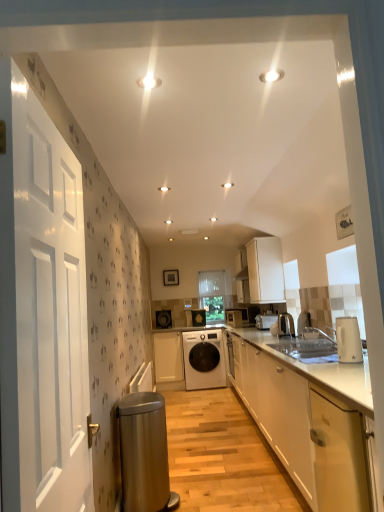
Question: Is white matte cabinet at upper center, positioned as the 3th cabinetry in front-to-back order, wider than white glossy toaster at center, the fourth appliance viewed from the back?

Choices:
 (A) yes
 (B) no

Answer: (A)

Question: Is white matte cabinet at upper center, positioned as the 3th cabinetry in front-to-back order, taller than white glossy toaster at center, the fourth appliance viewed from the back?

Choices:
 (A) yes
 (B) no

Answer: (A)

Question: Does white matte cabinet at upper center, the second cabinetry in the back-to-front sequence, have a smaller size compared to white glossy toaster at center, the fourth appliance viewed from the back?

Choices:
 (A) yes
 (B) no

Answer: (B)

Question: From a real-world perspective, is white matte cabinet at upper center, positioned as the 3th cabinetry in front-to-back order, located beneath white glossy toaster at center, the fourth appliance viewed from the back?

Choices:
 (A) yes
 (B) no

Answer: (B)

Question: From the image's perspective, would you say white matte cabinet at upper center, which is the fourth cabinetry in left-to-right order, is shown under white glossy toaster at center, the fourth appliance viewed from the back?

Choices:
 (A) no
 (B) yes

Answer: (A)

Question: Looking at the image, does matte black washing machine at center, the 2th appliance from the back, seem bigger or smaller compared to white glossy cabinet at lower right, the 2th cabinetry in the left-to-right sequence?

Choices:
 (A) small
 (B) big

Answer: (A)

Question: In the image, is matte black washing machine at center, the 5th appliance positioned from the front, positioned in front of or behind white glossy cabinet at lower right, the third cabinetry from the right?

Choices:
 (A) behind
 (B) front

Answer: (A)

Question: In the image, is matte black washing machine at center, the 2th appliance from the back, on the left side or the right side of white glossy cabinet at lower right, the third cabinetry from the right?

Choices:
 (A) right
 (B) left

Answer: (B)

Question: Is matte black washing machine at center, the 2th appliance from the back, taller or shorter than white glossy cabinet at lower right, the third cabinetry from the right?

Choices:
 (A) tall
 (B) short

Answer: (B)

Question: Does point (213, 310) appear closer or farther from the camera than point (291, 396)?

Choices:
 (A) farther
 (B) closer

Answer: (A)

Question: Looking at their shapes, would you say transparent plastic window screen at center is wider or thinner than white glossy cabinet at lower right, acting as the 2th cabinetry starting from the front?

Choices:
 (A) thin
 (B) wide

Answer: (A)

Question: Is transparent plastic window screen at center in front of or behind white glossy cabinet at lower right, arranged as the 2th cabinetry when viewed from the right, in the image?

Choices:
 (A) front
 (B) behind

Answer: (B)

Question: From the image's perspective, is transparent plastic window screen at center positioned above or below white glossy cabinet at lower right, arranged as the third cabinetry when viewed from the back?

Choices:
 (A) above
 (B) below

Answer: (A)

Question: From their relative heights in the image, would you say metallic silver kettle at right, which is the 2th appliance from front to back, is taller or shorter than matte black washing machine at center, the 2th appliance from the back?

Choices:
 (A) short
 (B) tall

Answer: (A)

Question: From a real-world perspective, is metallic silver kettle at right, marked as the 5th appliance in a back-to-front arrangement, positioned above or below matte black washing machine at center, the 5th appliance positioned from the front?

Choices:
 (A) above
 (B) below

Answer: (B)